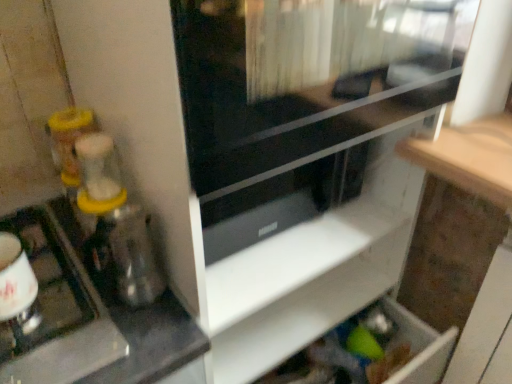
Question: Do you think metallic silver kettle at left is within transparent glass screen door at upper center, or outside of it?

Choices:
 (A) outside
 (B) inside

Answer: (A)

Question: From their relative heights in the image, would you say metallic silver kettle at left is taller or shorter than transparent glass screen door at upper center?

Choices:
 (A) short
 (B) tall

Answer: (A)

Question: Which is nearer to the metallic silver kettle at left?

Choices:
 (A) transparent plastic blender at left
 (B) white matte drawer at lower center
 (C) transparent glass screen door at upper center

Answer: (A)

Question: Estimate the real-world distances between objects in this image. Which object is farther from the transparent plastic blender at left?

Choices:
 (A) metallic silver kettle at left
 (B) white matte drawer at lower center
 (C) transparent glass screen door at upper center

Answer: (C)